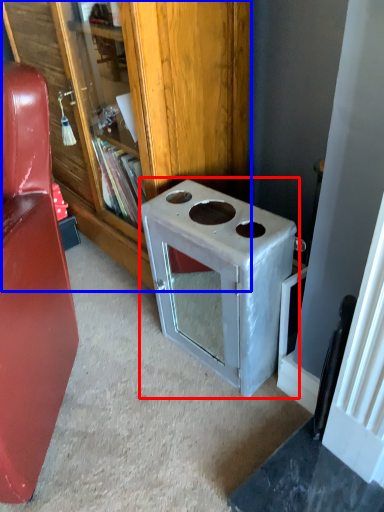
Question: Among these objects, which one is farthest to the camera, appliance (highlighted by a red box) or bookcase (highlighted by a blue box)?

Choices:
 (A) appliance
 (B) bookcase

Answer: (B)